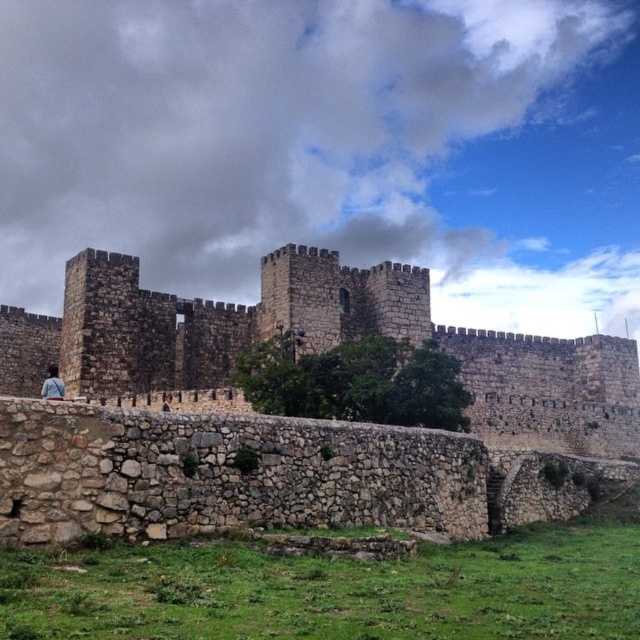
Does brown stone castle at center appear on the left side of denim jacket at lower left?

In fact, brown stone castle at center is to the right of denim jacket at lower left.

Who is lower down, brown stone castle at center or denim jacket at lower left?

denim jacket at lower left

Is point (68, 285) positioned after point (54, 376)?

No, (68, 285) is closer to viewer.

This screenshot has width=640, height=640. I want to click on brown stone castle at center, so click(321, 346).